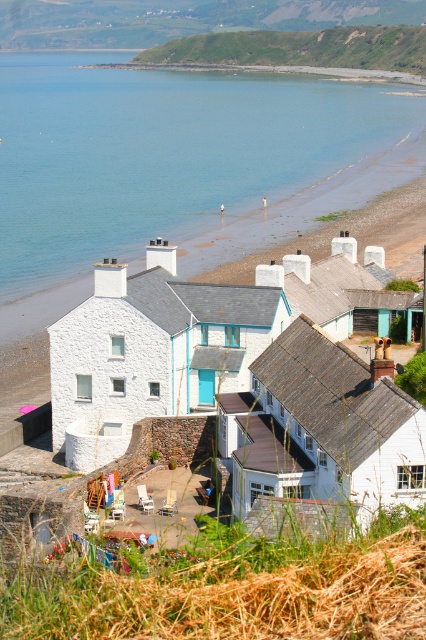
Is point (132, 164) less distant than point (127, 314)?

No, (132, 164) is further to viewer.

Between blue water at center and white stone house at center, which one appears on the right side from the viewer's perspective?

Positioned to the right is blue water at center.

Locate an element on the screen. blue water at center is located at coordinates (161, 154).

Between point (189, 353) and point (327, 48), which one is positioned in front?

Point (189, 353)

Who is lower down, white stone house at center or green grassy hillside at upper center?

white stone house at center is below.

Is point (108, 422) positioned before point (279, 54)?

Yes, it is in front of point (279, 54).

Identify the location of white stone house at center. (150, 352).

Can you confirm if white wood house at center is positioned to the left of green grassy hillside at upper center?

Yes, white wood house at center is to the left of green grassy hillside at upper center.

Which is behind, point (317, 390) or point (345, 51)?

Positioned behind is point (345, 51).

Does point (310, 481) lie in front of point (345, 35)?

Yes.

The image size is (426, 640). I want to click on white wood house at center, so click(x=325, y=435).